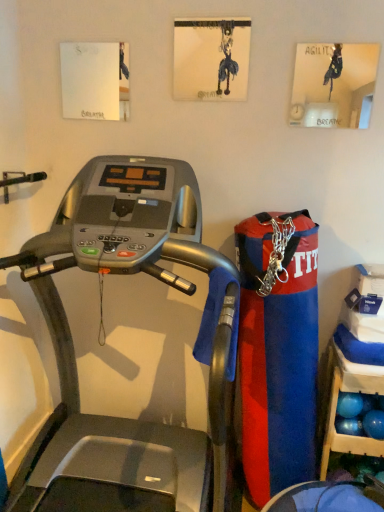
Question: Relative to blue plastic shelf at lower right, is silver metallic treadmill at center in front or behind?

Choices:
 (A) behind
 (B) front

Answer: (B)

Question: From a real-world perspective, is silver metallic treadmill at center above or below blue plastic shelf at lower right?

Choices:
 (A) above
 (B) below

Answer: (A)

Question: Do you think silver metallic treadmill at center is within blue plastic shelf at lower right, or outside of it?

Choices:
 (A) outside
 (B) inside

Answer: (A)

Question: Is point (340, 446) closer or farther from the camera than point (104, 256)?

Choices:
 (A) closer
 (B) farther

Answer: (B)

Question: In the image, is blue plastic shelf at lower right on the left side or the right side of silver metallic treadmill at center?

Choices:
 (A) right
 (B) left

Answer: (A)

Question: Considering their positions, is blue plastic shelf at lower right located in front of or behind silver metallic treadmill at center?

Choices:
 (A) front
 (B) behind

Answer: (B)

Question: In terms of width, does blue plastic shelf at lower right look wider or thinner when compared to silver metallic treadmill at center?

Choices:
 (A) thin
 (B) wide

Answer: (A)